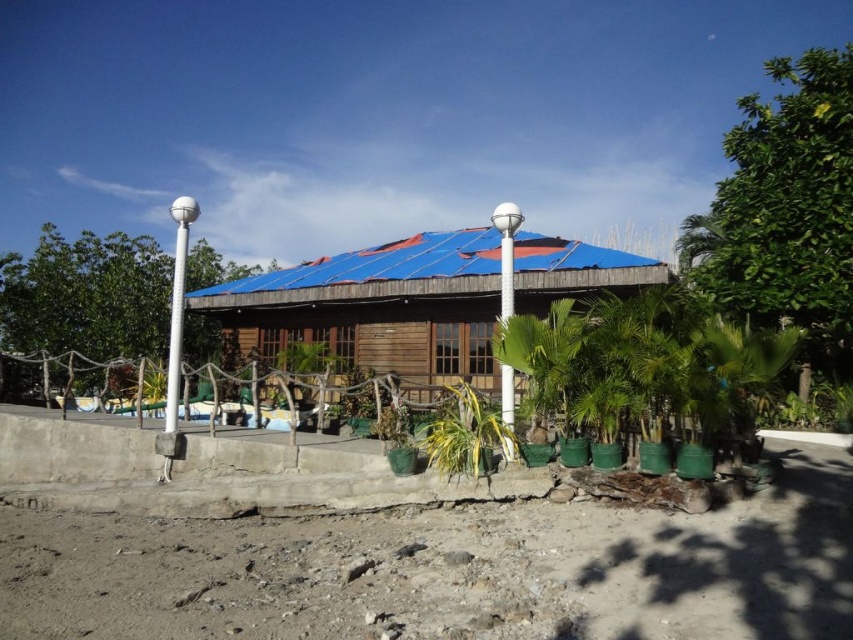
Which is behind, point (843, 113) or point (462, 420)?

Positioned behind is point (843, 113).

How much distance is there between green leafy tree at upper right and green leafy palm tree at center?

29.79 feet

Where is `green leafy tree at upper right`? green leafy tree at upper right is located at coordinates (786, 212).

Image resolution: width=853 pixels, height=640 pixels. I want to click on green leafy tree at upper right, so click(x=786, y=212).

Is green leafy tree at left positioned behind green leafy palm tree at center?

Yes.

Does green leafy tree at left have a greater width compared to green leafy palm tree at center?

Indeed, green leafy tree at left has a greater width compared to green leafy palm tree at center.

Measure the distance between point (7, 262) and camera.

23.24 meters

This screenshot has width=853, height=640. I want to click on green leafy tree at left, so click(x=86, y=296).

Between point (0, 317) and point (502, 372), which one is positioned in front?

Point (502, 372)

Which of these two, green leafy tree at left or white plastic pole at center, stands shorter?

white plastic pole at center is shorter.

Does point (67, 260) come in front of point (503, 234)?

No, it is not.

Locate an element on the screen. This screenshot has height=640, width=853. green leafy tree at left is located at coordinates (86, 296).